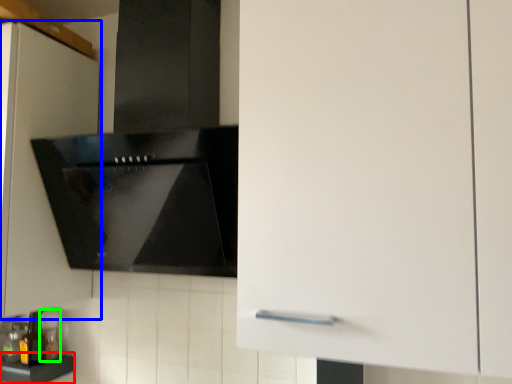
Question: Estimate the real-world distances between objects in this image. Which object is closer to counter top (highlighted by a red box), cabinetry (highlighted by a blue box) or bottle (highlighted by a green box)?

Choices:
 (A) cabinetry
 (B) bottle

Answer: (B)